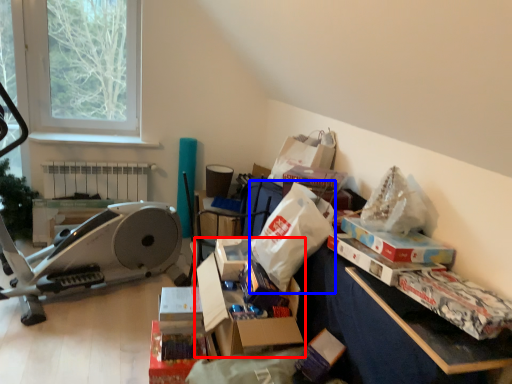
Question: Which object is closer to the camera taking this photo, storage box (highlighted by a red box) or paper bag (highlighted by a blue box)?

Choices:
 (A) storage box
 (B) paper bag

Answer: (A)